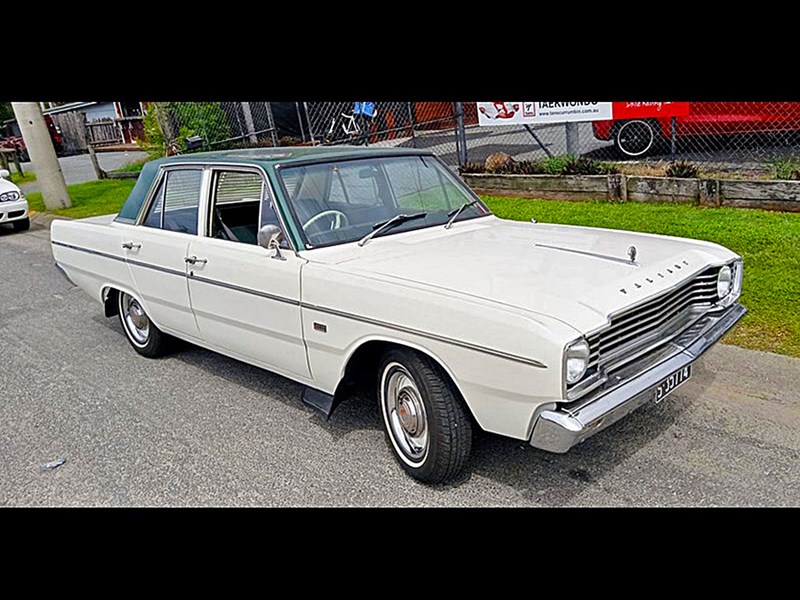
Where is `front door handle`? front door handle is located at coordinates (200, 261).